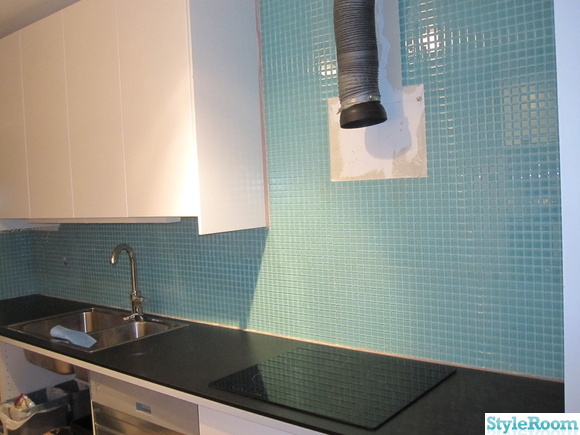
This screenshot has height=435, width=580. Find the location of `rag`. rag is located at coordinates (68, 334).